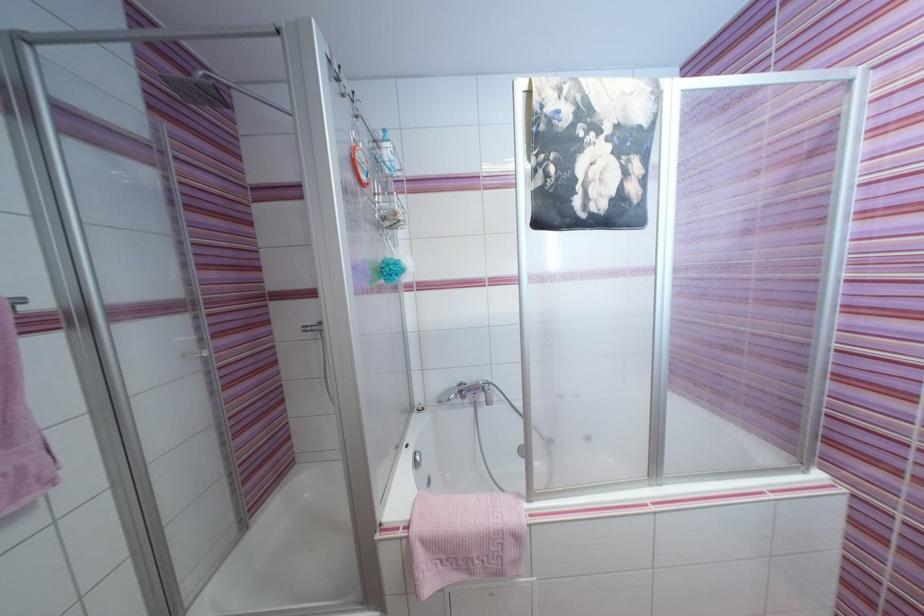
The width and height of the screenshot is (924, 616). I want to click on floral print towel, so [x=590, y=151].